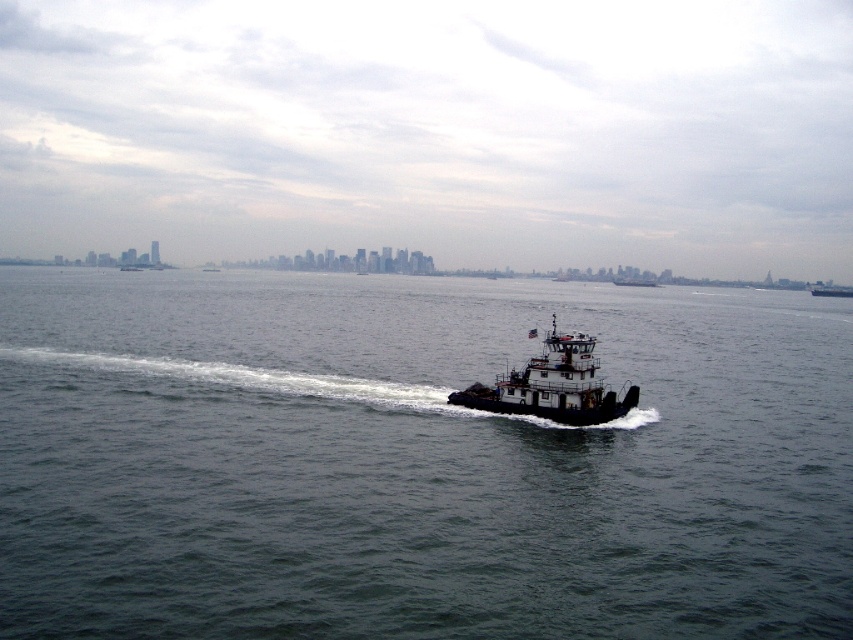
Looking at this image, you are a marine biologist observing the maritime scene. You need to determine if a 1000 feet long research vessel can safely pass between the black matte tugboat at center and the dark gray metallic tugboat at center without touching either. Can it?

The black matte tugboat at center and dark gray metallic tugboat at center are 860.98 feet apart from each other. Since the research vessel is 1000 feet long, it cannot safely pass between them as the distance is shorter than the vessel length.

You are a photographer on a boat trying to capture both the black matte tugboat at center and the metallic gray tugboat at center in the same shot. Based on their positions, which one is closer to the left side of your camera frame?

The black matte tugboat at center is to the left of metallic gray tugboat at center, so it is closer to the left side of the camera frame.